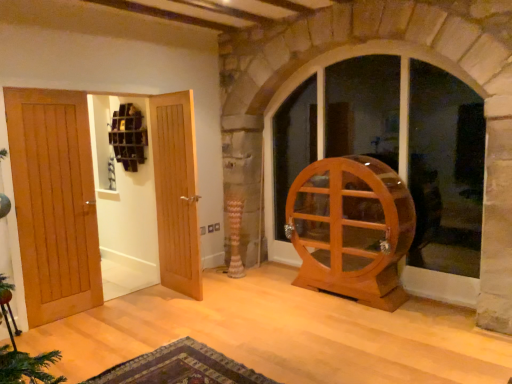
Question: Which is correct: carpeted rug at lower center is inside light brown wood door at center, marked as the 1th door in a right-to-left arrangement, or outside of it?

Choices:
 (A) outside
 (B) inside

Answer: (A)

Question: Would you say carpeted rug at lower center is to the left or to the right of light brown wood door at center, marked as the 1th door in a right-to-left arrangement, in the picture?

Choices:
 (A) left
 (B) right

Answer: (B)

Question: Which object is the farthest from the carpeted rug at lower center?

Choices:
 (A) light brown wood door at left, the 1th door viewed from the left
 (B) light brown wood door at left, which appears as the 2th door when viewed from the right
 (C) light brown wood door at center, marked as the 1th door in a right-to-left arrangement
 (D) transparent glass cabinet at center
 (E) light brown wood hamster wheel at right

Answer: (D)

Question: Which is nearer to the carpeted rug at lower center?

Choices:
 (A) transparent glass cabinet at center
 (B) light brown wood hamster wheel at right
 (C) light brown wood door at left, the 3th door in the right-to-left sequence
 (D) light brown wood door at left, which appears as the 2th door when viewed from the right
 (E) light brown wood door at center, which ranks as the third door in left-to-right order

Answer: (E)